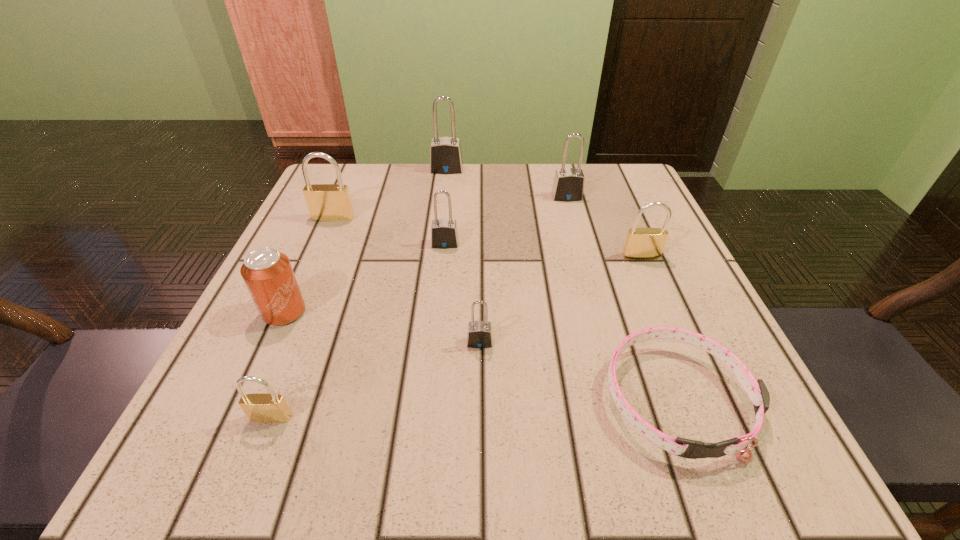
Find the location of a particular element. object that is at the near left corner is located at coordinates tap(262, 407).

Find the location of `object that is positioned at the far right corner`. object that is positioned at the far right corner is located at coordinates (568, 185).

I want to click on object that is at the near right corner, so click(756, 390).

The image size is (960, 540). Identify the location of free space at the far edge of the desktop. (425, 198).

Find the location of a particular element. free space at the near edge of the desktop is located at coordinates (487, 445).

The width and height of the screenshot is (960, 540). Find the location of `vacant region at the left edge of the desktop`. vacant region at the left edge of the desktop is located at coordinates (316, 328).

Find the location of a particular element. free space at the right edge of the desktop is located at coordinates (591, 239).

Image resolution: width=960 pixels, height=540 pixels. I want to click on vacant space at the near left corner, so click(207, 442).

Where is `vacant space at the far right corner`? The height and width of the screenshot is (540, 960). vacant space at the far right corner is located at coordinates (612, 181).

Identify the location of free space at the near right corner of the desktop. The image size is (960, 540). (728, 460).